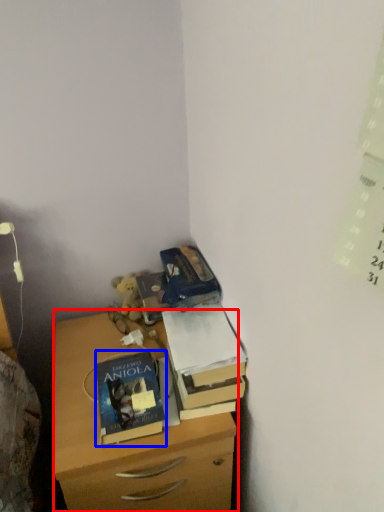
Question: Which object is closer to the camera taking this photo, chest of drawers (highlighted by a red box) or book (highlighted by a blue box)?

Choices:
 (A) chest of drawers
 (B) book

Answer: (A)